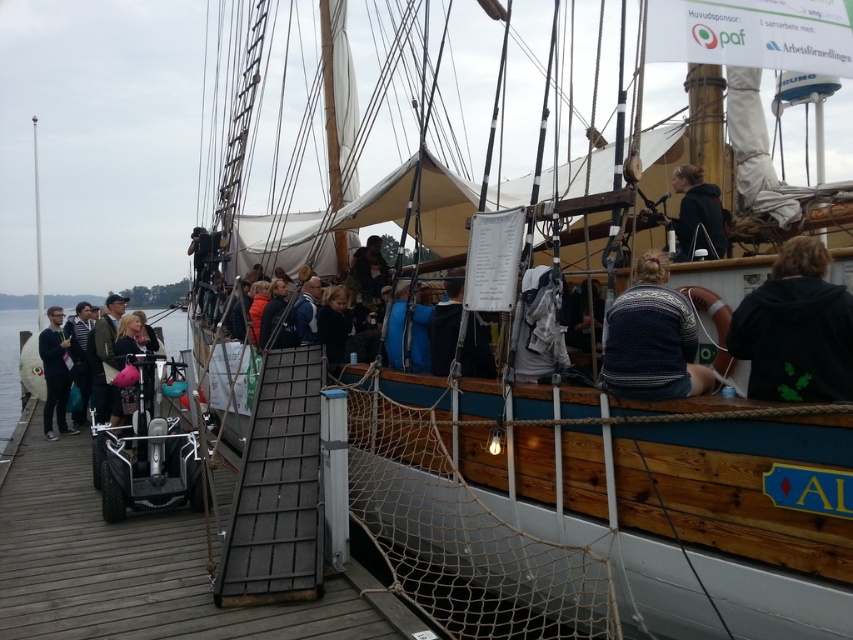
Which is more to the right, black hoodie at right or dark blue sweater at upper center?

From the viewer's perspective, dark blue sweater at upper center appears more on the right side.

Where is `black hoodie at right`? black hoodie at right is located at coordinates (795, 330).

Is knitted sweater at center positioned at the back of dark gray fabric jacket at left?

No, knitted sweater at center is closer to the viewer.

From the picture: Does knitted sweater at center have a lesser width compared to dark gray fabric jacket at left?

Correct, knitted sweater at center's width is less than dark gray fabric jacket at left's.

At what (x,y) coordinates should I click in order to perform the action: click on knitted sweater at center. Please return your answer as a coordinate pair (x, y). The height and width of the screenshot is (640, 853). Looking at the image, I should click on (651, 339).

Can you confirm if dark gray fabric jacket at left is shorter than white wood mast at upper center?

Correct, dark gray fabric jacket at left is not as tall as white wood mast at upper center.

Is dark gray fabric jacket at left closer to camera compared to white wood mast at upper center?

Yes, it is.

Is point (86, 344) positioned in front of point (36, 202)?

Yes, point (86, 344) is in front of point (36, 202).

Locate an element on the screen. This screenshot has height=640, width=853. dark gray fabric jacket at left is located at coordinates (103, 355).